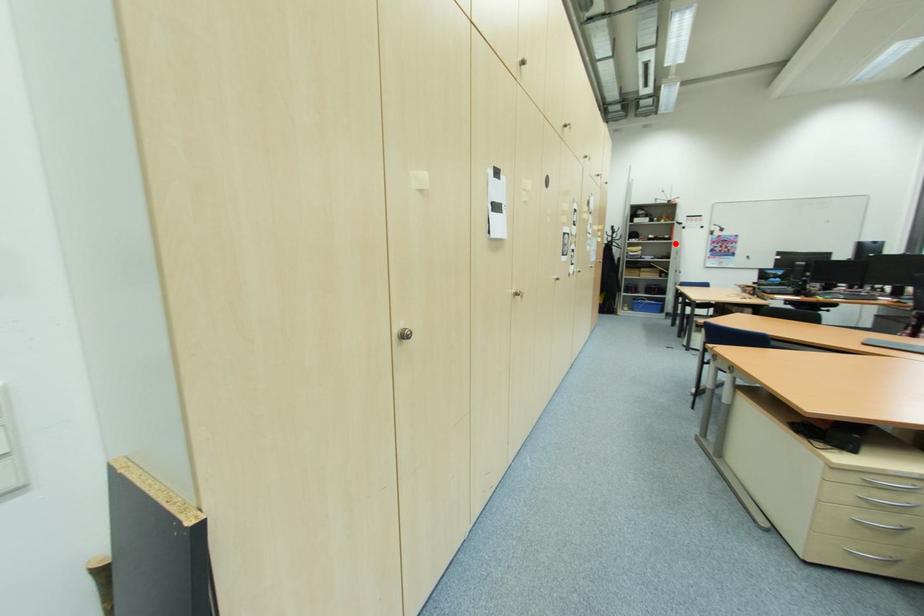
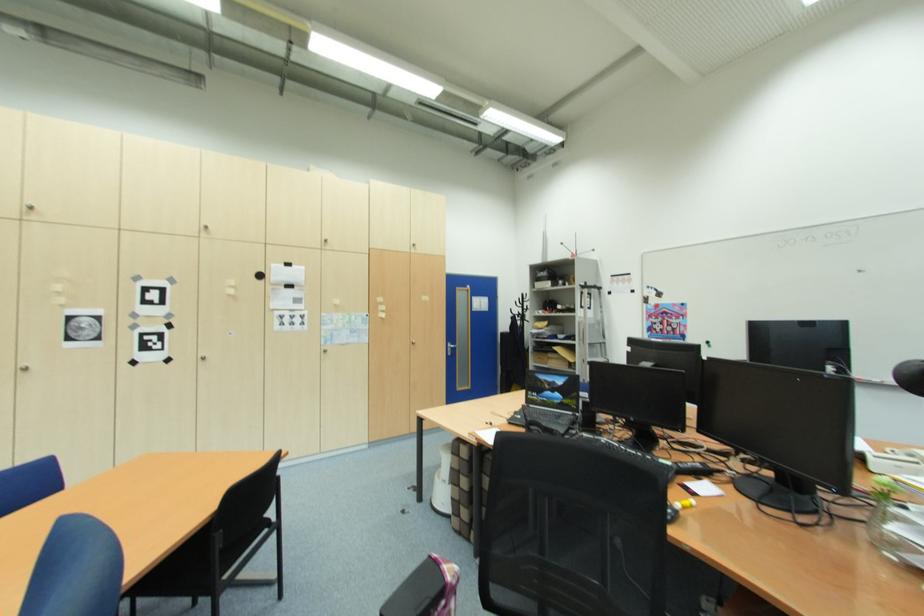
Question: I am providing you with two images of the same scene from different viewpoints. A red point is shown in image1. For the corresponding object point in image2, is it positioned nearer or farther from the camera?

Choices:
 (A) Nearer
 (B) Farther

Answer: (B)